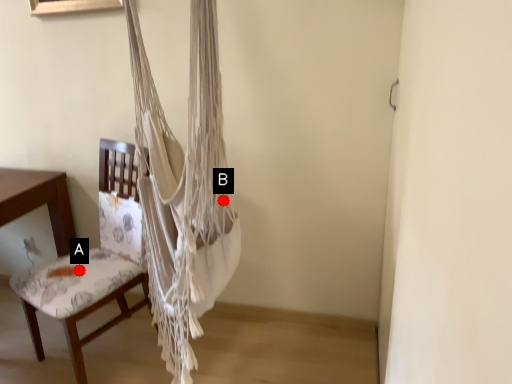
Question: Two points are circled on the image, labeled by A and B beside each circle. Which point is closer to the camera taking this photo?

Choices:
 (A) A is closer
 (B) B is closer

Answer: (B)